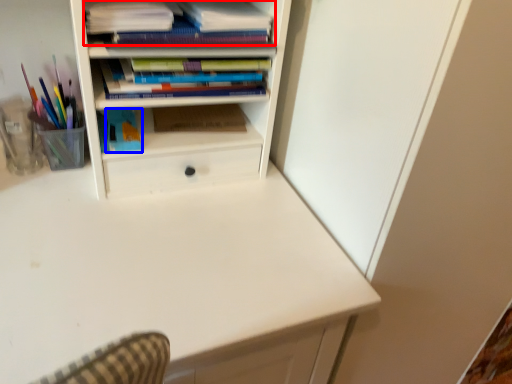
Question: Among these objects, which one is nearest to the camera, book (highlighted by a red box) or paperback book (highlighted by a blue box)?

Choices:
 (A) book
 (B) paperback book

Answer: (A)